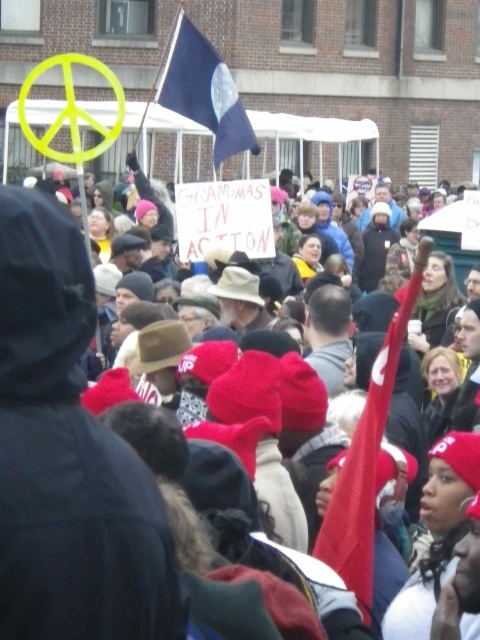
Question: Is red fabric flag at center bigger than blue fabric flag at upper center?

Choices:
 (A) yes
 (B) no

Answer: (B)

Question: Which object is closer to the camera taking this photo?

Choices:
 (A) blue fabric flag at upper center
 (B) red fabric flag at center

Answer: (B)

Question: Which point is farther from the camera taking this photo?

Choices:
 (A) (360, 563)
 (B) (216, 109)

Answer: (B)

Question: Where is red fabric flag at center located in relation to blue fabric flag at upper center in the image?

Choices:
 (A) left
 (B) right

Answer: (B)

Question: Does red fabric flag at center appear over blue fabric flag at upper center?

Choices:
 (A) yes
 (B) no

Answer: (B)